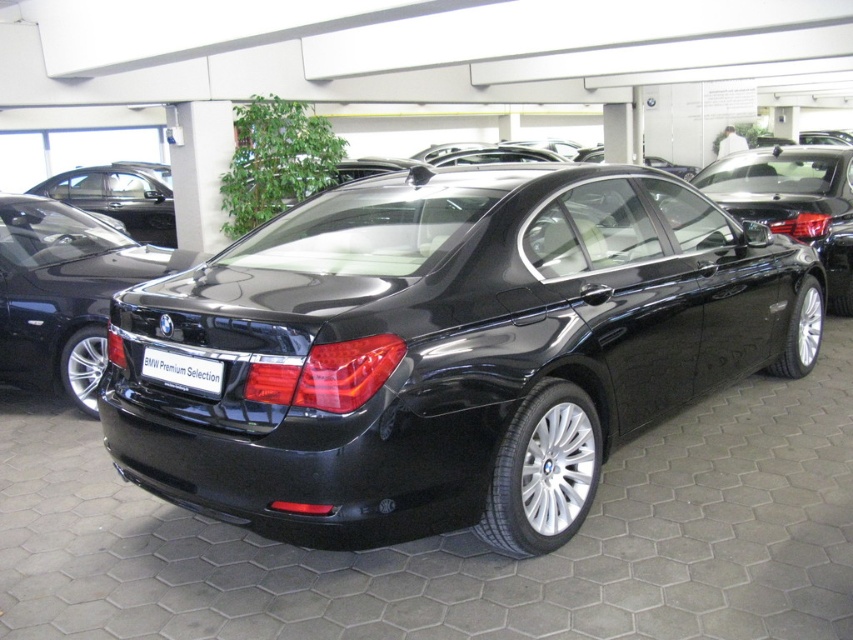
You are a car salesperson standing in the showroom. You need to direct a customer to the black metallic sedan at center. Which direction should you point relative to the glossy black sedan at center?

The black metallic sedan at center is located below the glossy black sedan at center, so you should point downward from the glossy black sedan at center to direct the customer.

Consider the image. You are standing in a showroom and want to locate the black metallic sedan at center. According to the coordinates provided, where would you find it?

The black metallic sedan at center is located at the 2D coordinates point (448, 349).